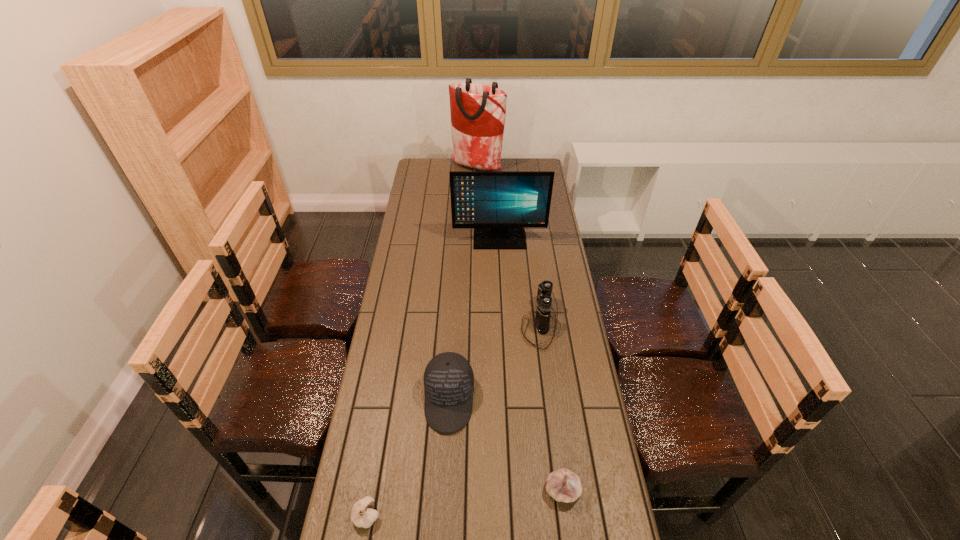
Locate an element on the screen. the farthest object is located at coordinates (478, 111).

Where is `grocery bag`? This screenshot has width=960, height=540. grocery bag is located at coordinates (478, 111).

At what (x,y) coordinates should I click in order to perform the action: click on the second tallest object. Please return your answer as a coordinate pair (x, y). Looking at the image, I should click on (498, 205).

In order to click on the fifth nearest object in this screenshot , I will do `click(498, 205)`.

Find the location of a particular element. baseball cap is located at coordinates (448, 378).

This screenshot has height=540, width=960. Identify the location of the third farthest object. (542, 319).

Where is `the taller garlic`? The height and width of the screenshot is (540, 960). the taller garlic is located at coordinates (563, 485).

Locate an element on the screen. This screenshot has width=960, height=540. the shortest object is located at coordinates (362, 515).

The width and height of the screenshot is (960, 540). I want to click on the leftmost object, so click(x=362, y=515).

Find the location of `vacant space positioned 0.210m on the left of the grocery bag`. vacant space positioned 0.210m on the left of the grocery bag is located at coordinates point(414,167).